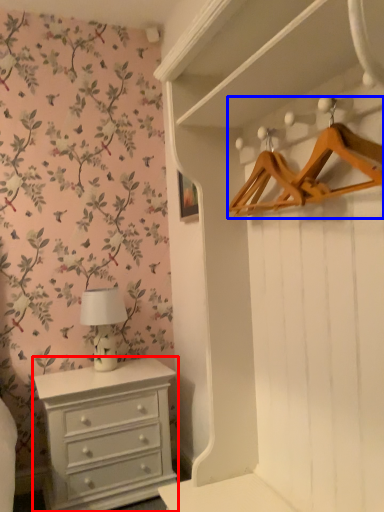
Question: Which of the following is the closest to the observer, chest of drawers (highlighted by a red box) or hanger (highlighted by a blue box)?

Choices:
 (A) chest of drawers
 (B) hanger

Answer: (B)